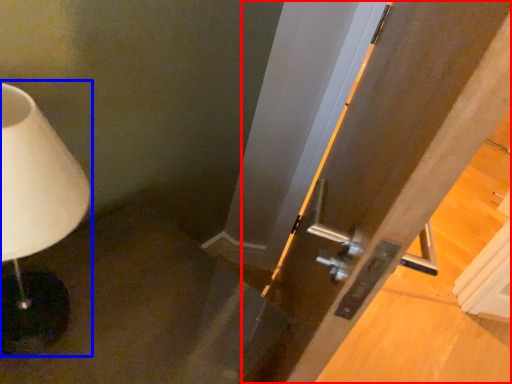
Question: Which object is further to the camera taking this photo, door (highlighted by a red box) or lamp (highlighted by a blue box)?

Choices:
 (A) door
 (B) lamp

Answer: (B)